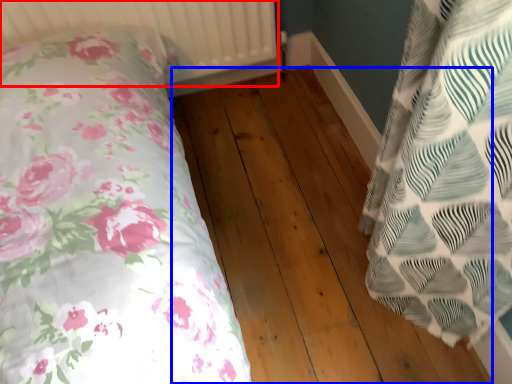
Question: Among these objects, which one is farthest to the camera, radiator (highlighted by a red box) or hardwood (highlighted by a blue box)?

Choices:
 (A) radiator
 (B) hardwood

Answer: (A)